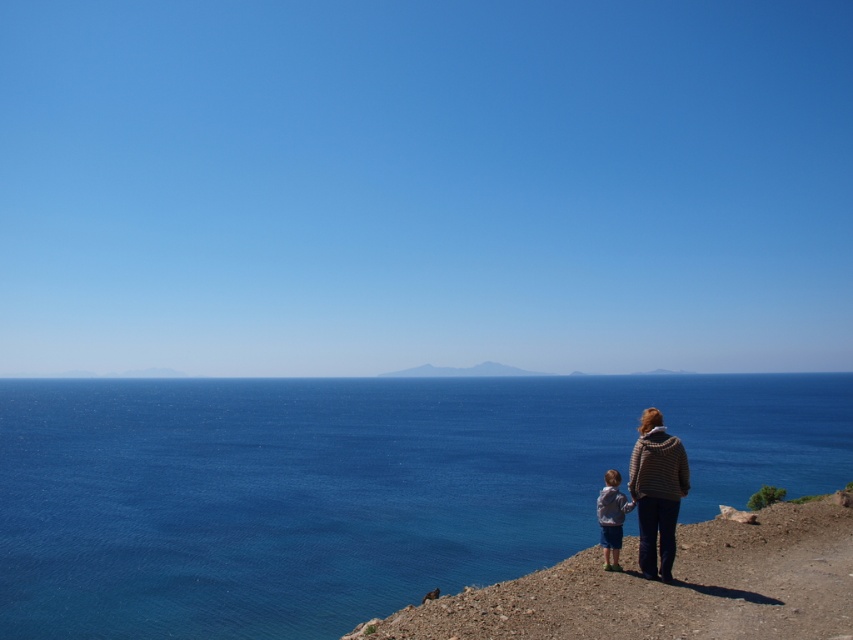
Question: Which object is closer to the camera taking this photo?

Choices:
 (A) brown dirt at lower right
 (B) striped sweater at right
 (C) light gray fleece jacket at lower right
 (D) blue water at lower left

Answer: (A)

Question: Based on their relative distances, which object is farther from the light gray fleece jacket at lower right?

Choices:
 (A) striped sweater at right
 (B) blue water at lower left
 (C) brown dirt at lower right

Answer: (B)

Question: Considering the real-world distances, which object is closest to the light gray fleece jacket at lower right?

Choices:
 (A) brown dirt at lower right
 (B) striped sweater at right
 (C) blue water at lower left

Answer: (B)

Question: Is blue water at lower left thinner than light gray fleece jacket at lower right?

Choices:
 (A) yes
 (B) no

Answer: (B)

Question: Is blue water at lower left to the left of striped sweater at right from the viewer's perspective?

Choices:
 (A) yes
 (B) no

Answer: (B)

Question: Considering the relative positions of brown dirt at lower right and light gray fleece jacket at lower right in the image provided, where is brown dirt at lower right located with respect to light gray fleece jacket at lower right?

Choices:
 (A) left
 (B) right

Answer: (A)